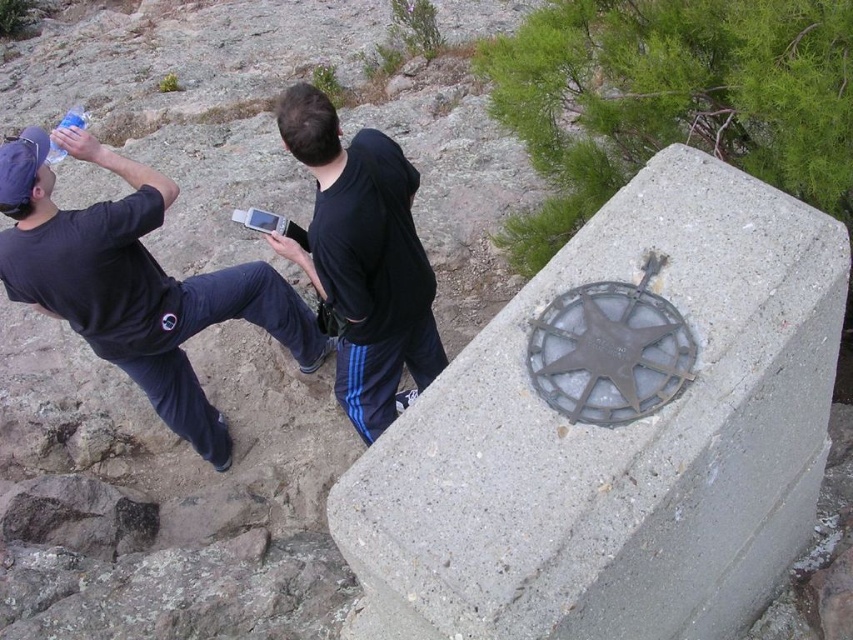
Question: Among these points, which one is farthest from the camera?

Choices:
 (A) coord(48,161)
 (B) coord(167,381)
 (C) coord(321,128)
 (D) coord(581,272)

Answer: (B)

Question: Is gray concrete at right bigger than black matte hoodie at center?

Choices:
 (A) no
 (B) yes

Answer: (B)

Question: Which object is positioned farthest from the black matte hoodie at center?

Choices:
 (A) gray concrete at right
 (B) matte black t-shirt at left

Answer: (A)

Question: Does black matte hoodie at center appear under translucent plastic bottle at upper left?

Choices:
 (A) no
 (B) yes

Answer: (B)

Question: Which object is farther from the camera taking this photo?

Choices:
 (A) translucent plastic bottle at upper left
 (B) matte black t-shirt at left
 (C) black matte hoodie at center

Answer: (A)

Question: Does matte black t-shirt at left have a smaller size compared to translucent plastic bottle at upper left?

Choices:
 (A) no
 (B) yes

Answer: (B)